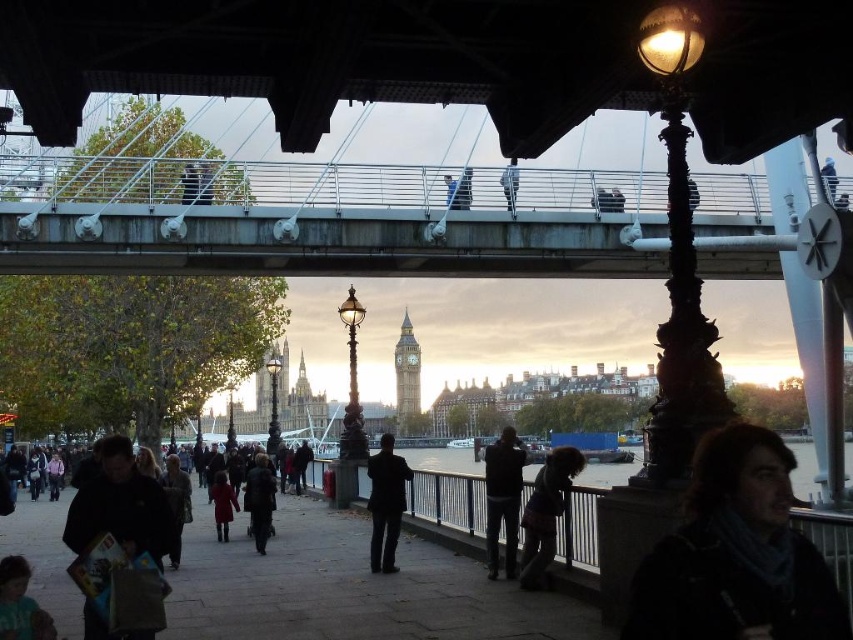
Question: Which point is closer to the camera?

Choices:
 (A) (503, 456)
 (B) (96, 452)
 (C) (297, 460)
 (D) (215, 516)

Answer: (A)

Question: Is metallic gray bridge at upper center bigger than matte black jacket at upper center?

Choices:
 (A) yes
 (B) no

Answer: (A)

Question: Is dark matte jacket at lower left positioned before brown textured coat at center?

Choices:
 (A) no
 (B) yes

Answer: (B)

Question: Is light blue denim jacket at lower left above matte red coat at center?

Choices:
 (A) no
 (B) yes

Answer: (A)

Question: Which point appears farthest from the camera in this image?

Choices:
 (A) (181, 500)
 (B) (194, 268)
 (C) (36, 614)
 (D) (503, 188)

Answer: (D)

Question: Which of these objects is positioned farthest from the dark gray jacket at center?

Choices:
 (A) metallic gray bridge at upper center
 (B) black fabric sidewalk at lower center
 (C) light blue denim jacket at lower left

Answer: (A)